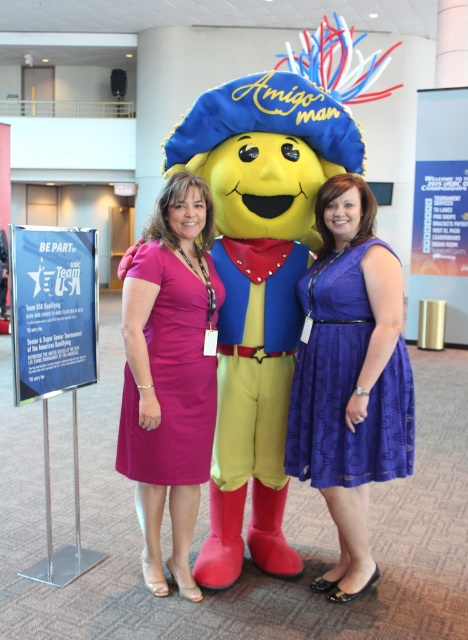
Question: Is purple lace dress at center above pink satin dress at center?

Choices:
 (A) no
 (B) yes

Answer: (B)

Question: Which of the following is the closest to the observer?

Choices:
 (A) purple lace dress at center
 (B) pink satin dress at center

Answer: (A)

Question: Among these points, which one is nearest to the camera?

Choices:
 (A) (339, 332)
 (B) (192, 408)

Answer: (A)

Question: Is purple lace dress at center to the left of pink satin dress at center from the viewer's perspective?

Choices:
 (A) yes
 (B) no

Answer: (B)

Question: Which point is farther to the camera?

Choices:
 (A) purple lace dress at center
 (B) pink satin dress at center

Answer: (B)

Question: Where is purple lace dress at center located in relation to pink satin dress at center in the image?

Choices:
 (A) right
 (B) left

Answer: (A)